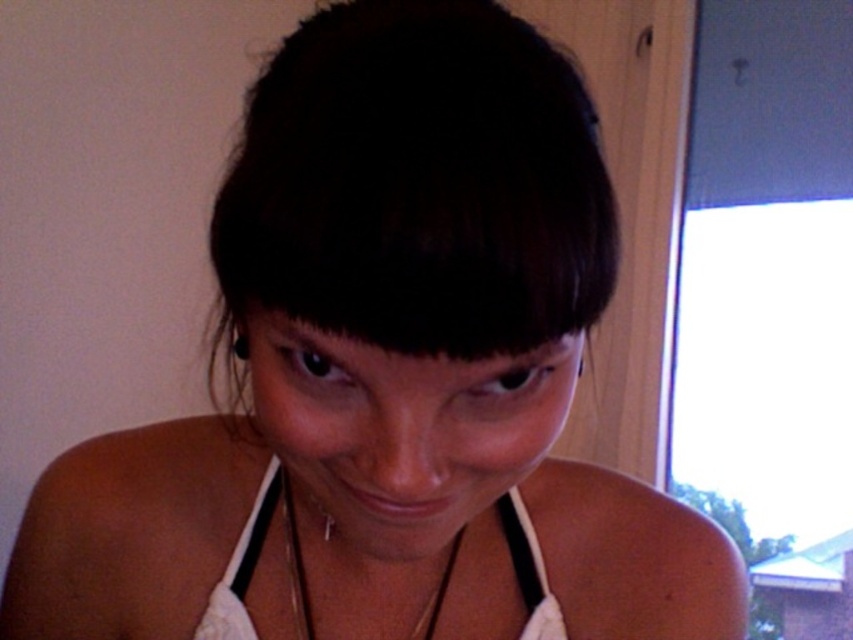
Question: Which of the following is the farthest from the observer?

Choices:
 (A) (x=297, y=252)
 (B) (x=225, y=570)

Answer: (B)

Question: Which object is the farthest from the white fabric bikini top at center?

Choices:
 (A) dark brown hair at center
 (B) white fabric strap at lower center

Answer: (A)

Question: Does dark brown hair at center have a smaller size compared to gold chain at lower center?

Choices:
 (A) yes
 (B) no

Answer: (B)

Question: Does white fabric bikini top at center appear on the right side of white fabric strap at lower center?

Choices:
 (A) no
 (B) yes

Answer: (A)

Question: Does dark brown hair at center appear under white fabric strap at lower center?

Choices:
 (A) no
 (B) yes

Answer: (A)

Question: Which point is farther to the camera?

Choices:
 (A) gold chain at lower center
 (B) white fabric bikini top at center
 (C) dark brown hair at center
 (D) white fabric strap at lower center

Answer: (D)